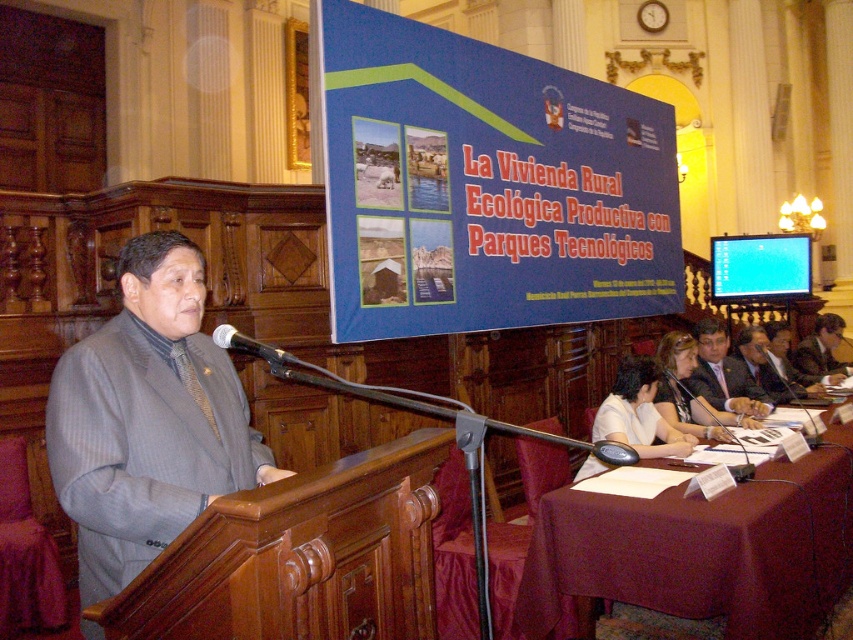
You are attending a presentation in a conference room and notice two points marked on the floor. The first point is at coordinates point [727,400] and the second point is at point [248,340]. If you are standing at the second point, which direction should you face to see the first point?

Since point [727,400] is behind point [248,340], you should face backward to see the first point.

You are an event organizer who needs to arrange seating for attendees. You have two suits in the room, the matte gray suit at center and the dark gray wool suit at lower right. Which suit is positioned lower in the image?

The matte gray suit at center is located below the dark gray wool suit at lower right, so it is positioned lower in the image.